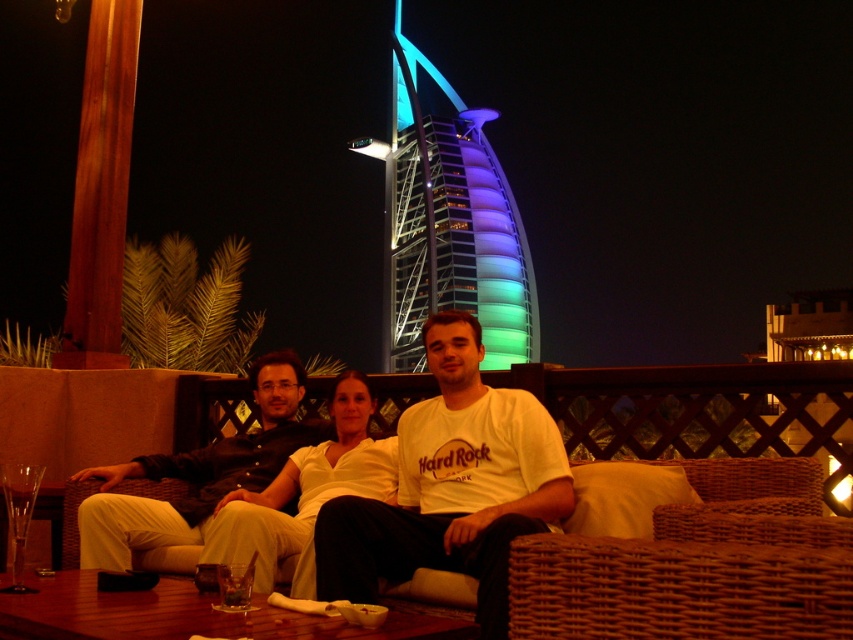
You are standing on the rooftop and want to take a photo of the multicolored glass tower at center and the light beige fabric couch at center. Which object should you position to your left to frame both in the shot?

Position the light beige fabric couch at center to your left since the multicolored glass tower at center is to the right of it, allowing both to be framed in the photo.

You are a photographer trying to capture the scene with a camera. You want to ensure that both the white cotton shirt at center and the clear glass wine glass at lower left are in focus. Given their sizes, which object should you prioritize focusing on first to ensure proper depth of field?

The white cotton shirt at center is wider than the clear glass wine glass at lower left. Since depth of field is influenced by the size of the subject in the frame, prioritizing focus on the wider white cotton shirt at center would help maintain both in focus more effectively.

You are a photographer trying to capture a closeup of the clear glass wine glass at lower left without including the white cotton shirt at center in the frame. Is this possible given their positions?

The white cotton shirt at center is in front of the clear glass wine glass at lower left, so it would block the view of the glass. Therefore, capturing a closeup of the clear glass wine glass at lower left without including the white cotton shirt at center is not possible.